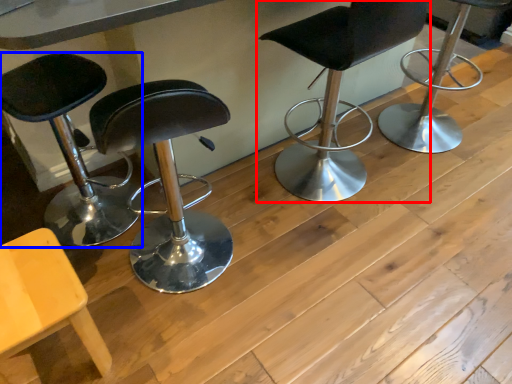
Question: Which point is closer to the camera, chair (highlighted by a red box) or chair (highlighted by a blue box)?

Choices:
 (A) chair
 (B) chair

Answer: (B)